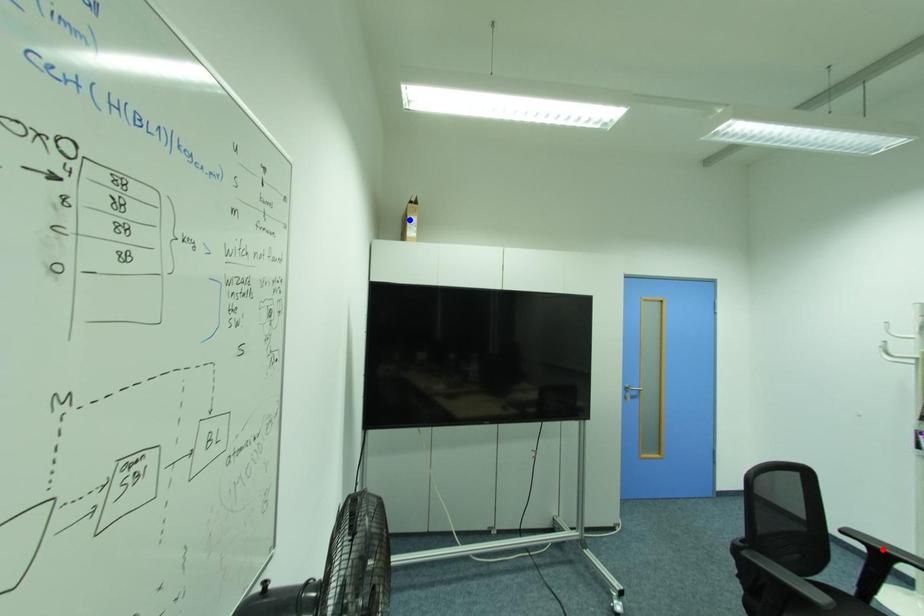
Question: Two points are marked on the image. Which point is closer to the camera?

Choices:
 (A) Blue point is closer.
 (B) Red point is closer.

Answer: (B)